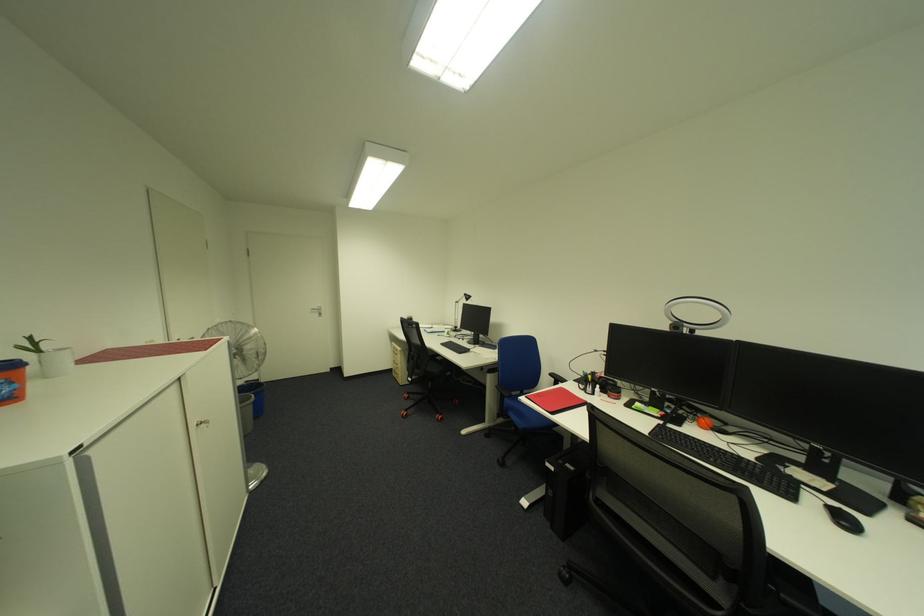
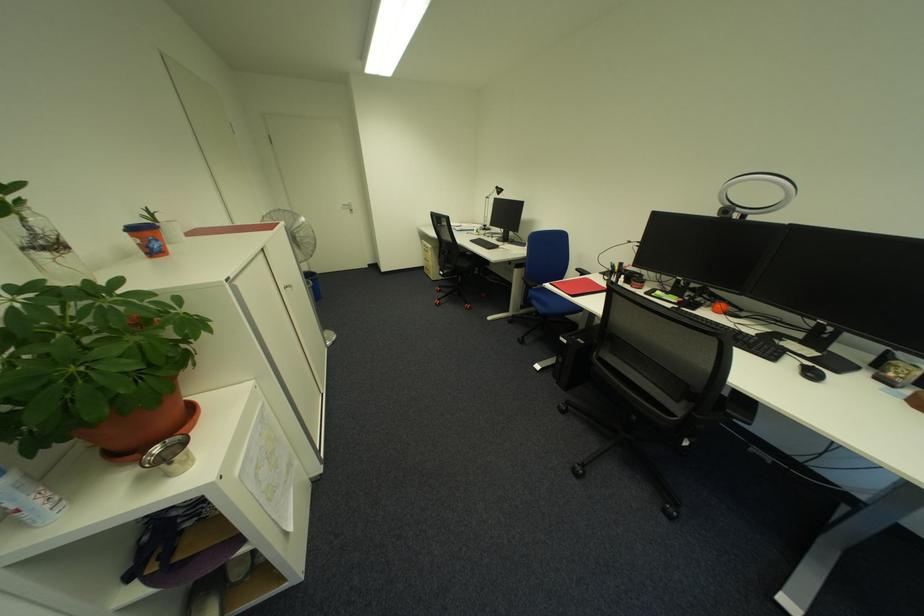
Question: The images are taken continuously from a first-person perspective. In which direction are you moving?

Choices:
 (A) Left
 (B) Right
 (C) Forward
 (D) Backward

Answer: (D)